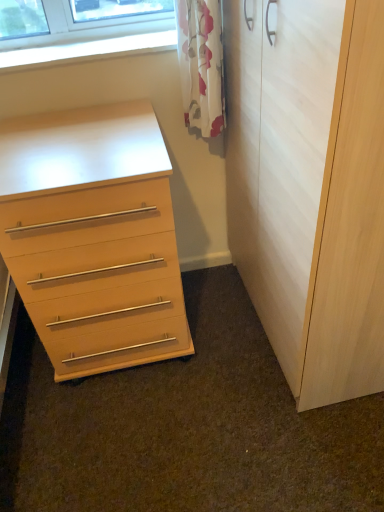
The image size is (384, 512). Find the location of `blank space situated above light wood/finish chest of drawers at left (from a real-world perspective)`. blank space situated above light wood/finish chest of drawers at left (from a real-world perspective) is located at coordinates (73, 141).